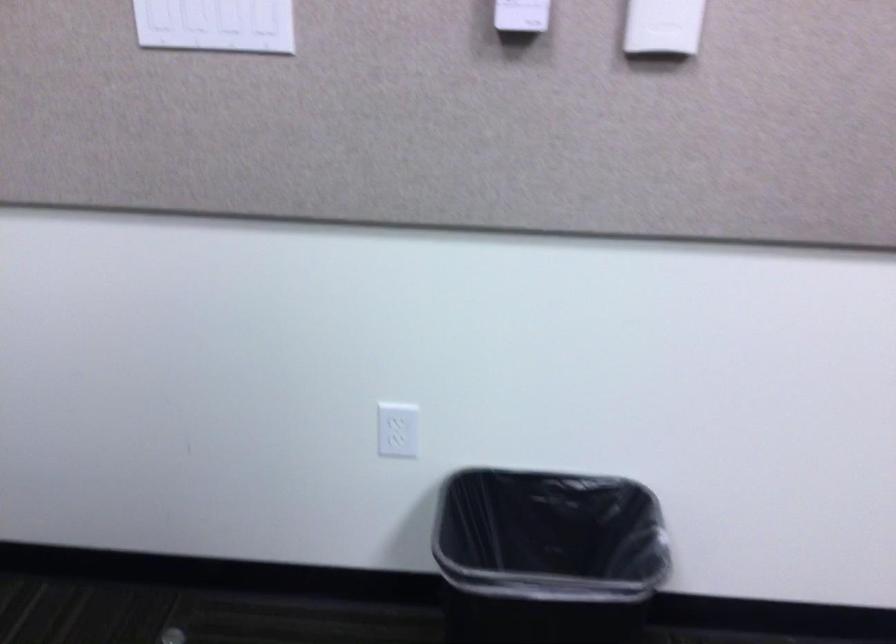
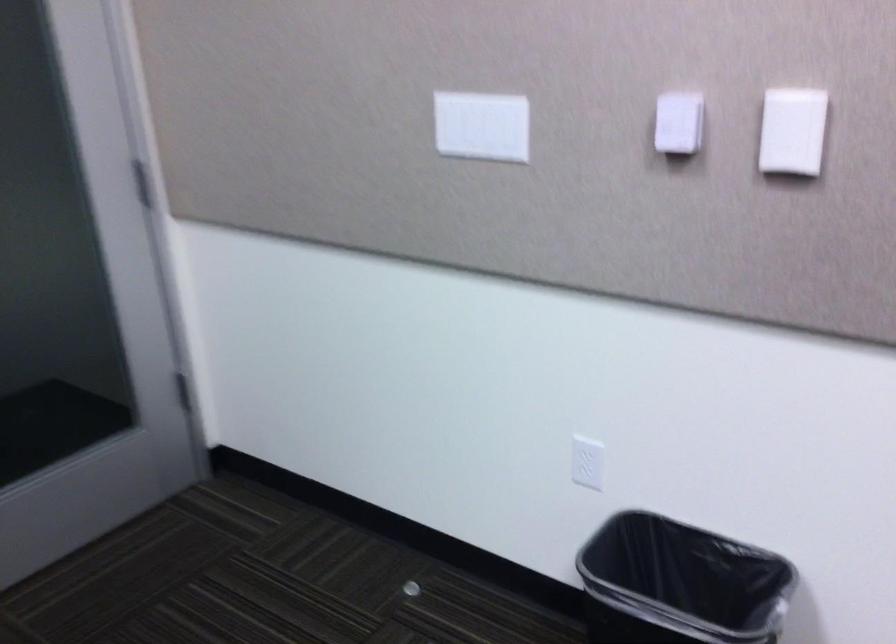
Where in the second image is the point corresponding to [400,431] from the first image?

(587, 462)